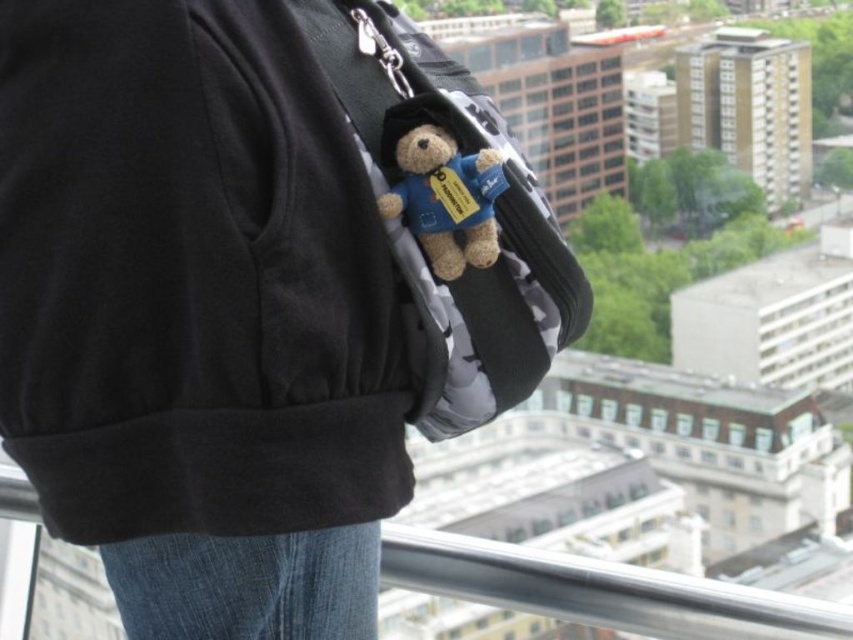
Who is shorter, camouflage fabric backpack at center or fuzzy fabric teddy bear at center?

Standing shorter between the two is fuzzy fabric teddy bear at center.

Can you confirm if camouflage fabric backpack at center is taller than fuzzy fabric teddy bear at center?

Yes, camouflage fabric backpack at center is taller than fuzzy fabric teddy bear at center.

What are the coordinates of `camouflage fabric backpack at center` in the screenshot? It's located at (236, 269).

Find the location of a particular element. camouflage fabric backpack at center is located at coordinates (236, 269).